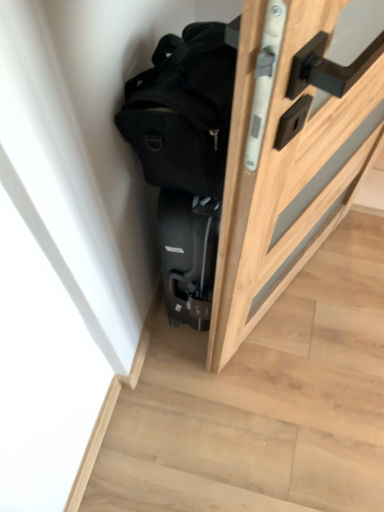
The height and width of the screenshot is (512, 384). What are the coordinates of `wooden door at right` in the screenshot? It's located at (288, 157).

What is the approximate height of black suitcase at lower left?

It is 2.32 inches.

At what (x,y) coordinates should I click in order to perform the action: click on wooden door at right. Please return your answer as a coordinate pair (x, y). This screenshot has width=384, height=512. Looking at the image, I should click on click(288, 157).

Can you confirm if black suitcase at lower left is bigger than wooden door at right?

Actually, black suitcase at lower left might be smaller than wooden door at right.

Is black suitcase at lower left wider than wooden door at right?

Indeed, black suitcase at lower left has a greater width compared to wooden door at right.

Does black suitcase at lower left contain wooden door at right?

That's incorrect, wooden door at right is not inside black suitcase at lower left.

Is black suitcase at lower left aimed at wooden door at right?

No, black suitcase at lower left is not oriented towards wooden door at right.

From the picture: Between black suitcase at lower left and black matte backpack at upper center, which one has less height?

black suitcase at lower left is shorter.

I want to click on stairwell that is under the black matte backpack at upper center (from a real-world perspective), so click(x=263, y=401).

Is black suitcase at lower left positioned in front of black matte backpack at upper center?

No, it is behind black matte backpack at upper center.

From the image's perspective, is black suitcase at lower left over black matte backpack at upper center?

No, from the image's perspective, black suitcase at lower left is not above black matte backpack at upper center.

Is the position of wooden door at right more distant than that of black matte backpack at upper center?

Yes, wooden door at right is further from the viewer.

In terms of height, does wooden door at right look taller or shorter compared to black matte backpack at upper center?

In the image, wooden door at right appears to be taller than black matte backpack at upper center.

Is black matte backpack at upper center a part of wooden door at right?

No, wooden door at right does not contain black matte backpack at upper center.

From the image's perspective, is wooden door at right below black matte backpack at upper center?

Indeed, from the image's perspective, wooden door at right is shown beneath black matte backpack at upper center.

Is black matte backpack at upper center aimed at black suitcase at lower left?

No, black matte backpack at upper center does not turn towards black suitcase at lower left.

Between black matte backpack at upper center and black suitcase at lower left, which one has less height?

Standing shorter between the two is black suitcase at lower left.

Is black matte backpack at upper center wider or thinner than black suitcase at lower left?

Clearly, black matte backpack at upper center has less width compared to black suitcase at lower left.

Would you say wooden door at right is a long distance from black suitcase at lower left?

Actually, wooden door at right and black suitcase at lower left are a little close together.

In the scene shown: Do you think wooden door at right is within black suitcase at lower left, or outside of it?

wooden door at right is not enclosed by black suitcase at lower left.

Which is more to the right, wooden door at right or black suitcase at lower left?

Positioned to the right is wooden door at right.

Looking at this image, how far apart are black matte backpack at upper center and wooden door at right?

black matte backpack at upper center is 11.45 inches from wooden door at right.

Is black matte backpack at upper center wider or thinner than wooden door at right?

Considering their sizes, black matte backpack at upper center looks broader than wooden door at right.

From a real-world perspective, which is physically above, black matte backpack at upper center or wooden door at right?

In real-world perspective, black matte backpack at upper center is above.

Can you confirm if black matte backpack at upper center is shorter than wooden door at right?

Yes.

This screenshot has height=512, width=384. In order to click on stairwell below the wooden door at right (from a real-world perspective) in this screenshot , I will do `click(263, 401)`.

Where is `stairwell behind the black matte backpack at upper center`? stairwell behind the black matte backpack at upper center is located at coordinates (263, 401).

Based on their spatial positions, is black matte backpack at upper center or wooden door at right closer to black suitcase at lower left?

wooden door at right is closer to black suitcase at lower left.

Which object lies further to the anchor point black matte backpack at upper center, black suitcase at lower left or wooden door at right?

The object further to black matte backpack at upper center is black suitcase at lower left.

Looking at the image, which one is located further to wooden door at right, black matte backpack at upper center or black suitcase at lower left?

Among the two, black suitcase at lower left is located further to wooden door at right.

Based on their spatial positions, is wooden door at right or black matte backpack at upper center closer to black suitcase at lower left?

wooden door at right is positioned closer to the anchor black suitcase at lower left.

Considering their positions, is wooden door at right positioned closer to black matte backpack at upper center than black suitcase at lower left?

The object closer to black matte backpack at upper center is wooden door at right.

Based on their spatial positions, is black suitcase at lower left or black matte backpack at upper center further from wooden door at right?

Based on the image, black suitcase at lower left appears to be further to wooden door at right.

The width and height of the screenshot is (384, 512). I want to click on door that lies between black matte backpack at upper center and black suitcase at lower left from top to bottom, so click(288, 157).